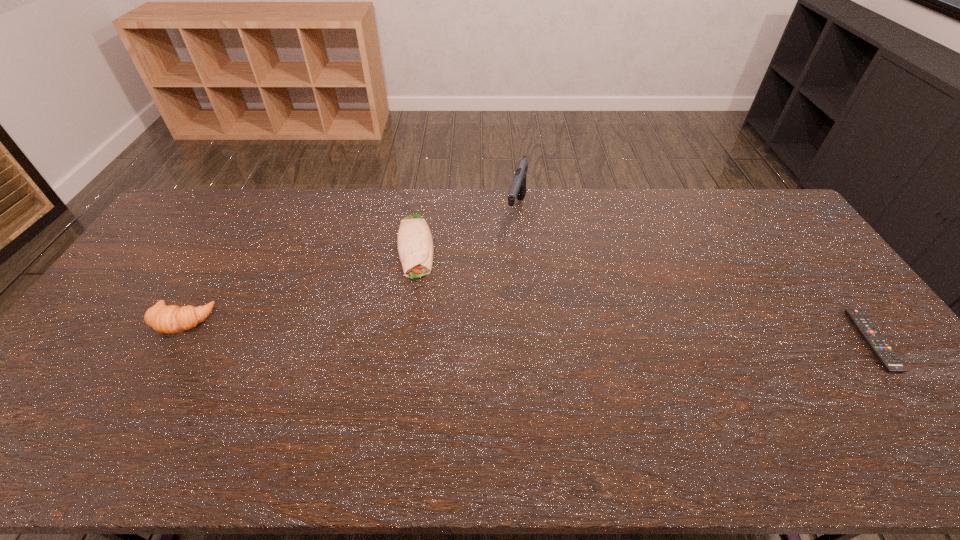
This screenshot has height=540, width=960. Identify the location of vacant space at the far edge. (646, 197).

At what (x,y) coordinates should I click in order to perform the action: click on vacant space at the near edge of the desktop. Please return your answer as a coordinate pair (x, y). Looking at the image, I should click on (358, 394).

Find the location of a particular element. Image resolution: width=960 pixels, height=540 pixels. free region at the left edge is located at coordinates (69, 363).

You are a GUI agent. You are given a task and a screenshot of the screen. Output one action in this format:
    pyautogui.click(x=<x>, y=<y>)
    Task: Click on the free location at the right edge of the desktop
    
    Given the screenshot: What is the action you would take?
    pyautogui.click(x=759, y=233)

Locate an element on the screen. This screenshot has height=540, width=960. vacant point at the far right corner is located at coordinates (762, 200).

The height and width of the screenshot is (540, 960). I want to click on vacant area that lies between the rightmost object and the crescent roll, so click(527, 331).

Locate an element on the screen. This screenshot has width=960, height=540. vacant space that's between the crescent roll and the tallest object is located at coordinates (348, 266).

At what (x,y) coordinates should I click in order to perform the action: click on free space between the third object from left to right and the second object from left to right. Please return your answer as a coordinate pair (x, y). The image size is (960, 540). Looking at the image, I should click on (466, 229).

Find the location of a particular element. This screenshot has width=960, height=540. free space between the leftmost object and the second object from left to right is located at coordinates (299, 284).

This screenshot has height=540, width=960. What are the coordinates of `free spot between the third object from right to left and the rightmost object` in the screenshot? It's located at (644, 294).